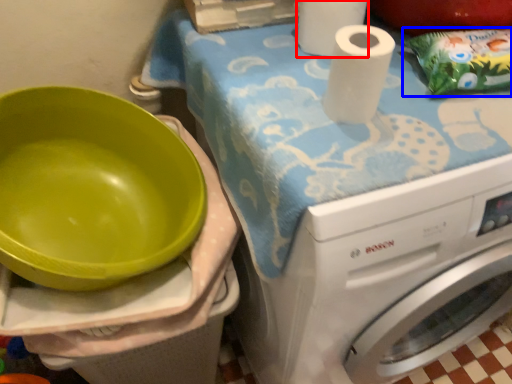
Question: Which point is closer to the camera, paper towel (highlighted by a red box) or waste (highlighted by a blue box)?

Choices:
 (A) paper towel
 (B) waste

Answer: (B)